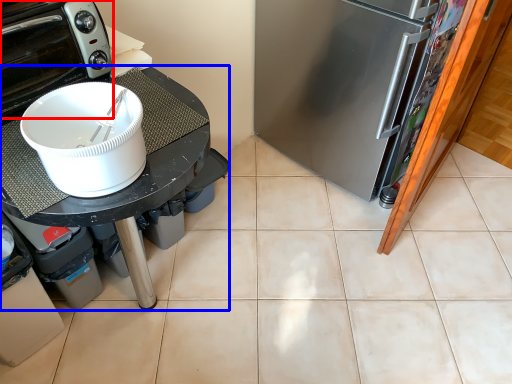
Question: Which object appears farthest to the camera in this image, home appliance (highlighted by a red box) or table (highlighted by a blue box)?

Choices:
 (A) home appliance
 (B) table

Answer: (A)